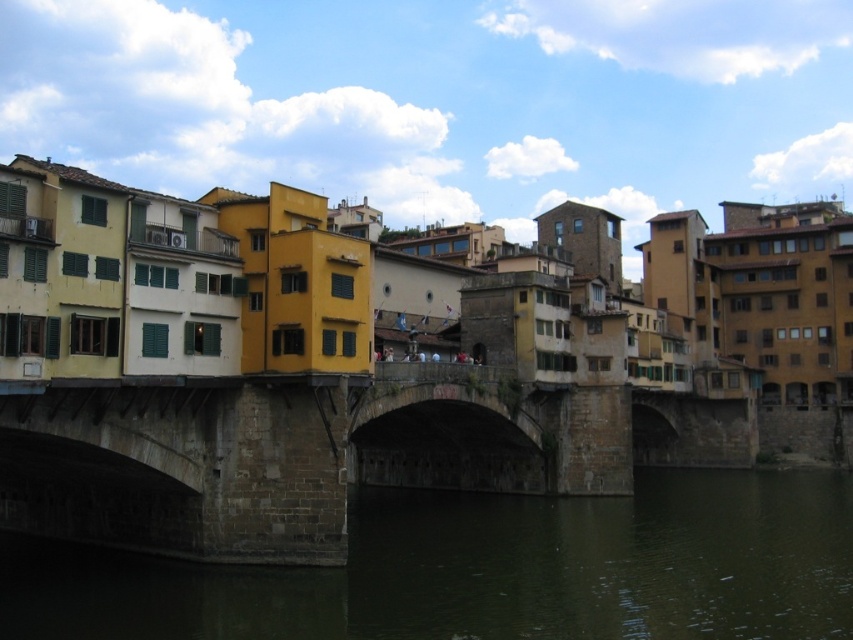
You are a tourist standing on the riverbank and want to take a photo of the stone bridge at center and the dark green water at center. Which object will appear larger in your photo?

The stone bridge at center will appear larger in the photo because it is bigger than the dark green water at center.